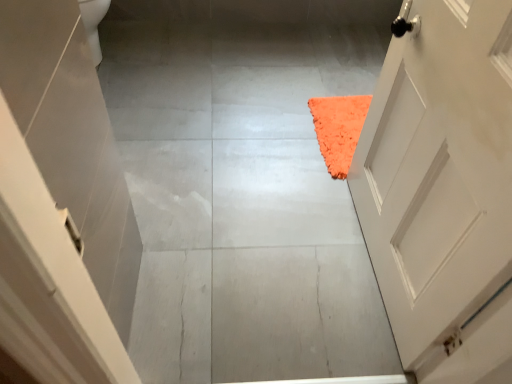
You are a GUI agent. You are given a task and a screenshot of the screen. Output one action in this format:
    pyautogui.click(x=<x>, y=<y>)
    Task: Click on the free spot above gray polished concrete at center (from a real-world perspective)
    The height and width of the screenshot is (384, 512).
    Given the screenshot: What is the action you would take?
    pyautogui.click(x=229, y=148)